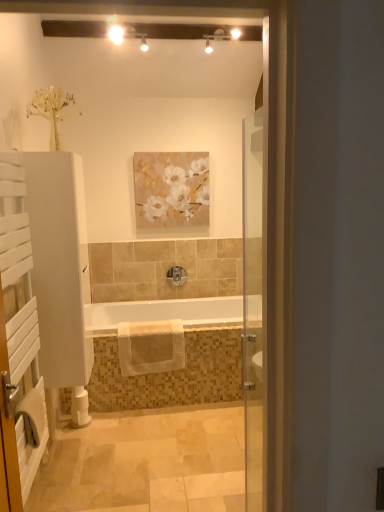
Question: Considering the relative sizes of white soft towel at lower left, which is the first bath towel from left to right, and polished chrome faucet at center in the image provided, is white soft towel at lower left, which is the first bath towel from left to right, smaller than polished chrome faucet at center?

Choices:
 (A) yes
 (B) no

Answer: (B)

Question: Considering the relative positions of white soft towel at lower left, which is the first bath towel from left to right, and polished chrome faucet at center in the image provided, is white soft towel at lower left, which is the first bath towel from left to right, to the left of polished chrome faucet at center from the viewer's perspective?

Choices:
 (A) yes
 (B) no

Answer: (A)

Question: Considering the relative sizes of white soft towel at lower left, arranged as the 2th bath towel when viewed from the right, and polished chrome faucet at center in the image provided, is white soft towel at lower left, arranged as the 2th bath towel when viewed from the right, taller than polished chrome faucet at center?

Choices:
 (A) yes
 (B) no

Answer: (B)

Question: Is white soft towel at lower left, which is the first bath towel from left to right, behind polished chrome faucet at center?

Choices:
 (A) no
 (B) yes

Answer: (A)

Question: Considering the relative sizes of white soft towel at lower left, the 2th bath towel from the back, and polished chrome faucet at center in the image provided, is white soft towel at lower left, the 2th bath towel from the back, wider than polished chrome faucet at center?

Choices:
 (A) yes
 (B) no

Answer: (A)

Question: Would you say polished chrome faucet at center is part of white soft towel at lower left, the 2th bath towel from the back,'s contents?

Choices:
 (A) yes
 (B) no

Answer: (B)

Question: Considering the relative positions of matte floral painting at upper center and white soft towel at lower left, arranged as the 2th bath towel when viewed from the right, in the image provided, is matte floral painting at upper center to the right of white soft towel at lower left, arranged as the 2th bath towel when viewed from the right, from the viewer's perspective?

Choices:
 (A) no
 (B) yes

Answer: (B)

Question: From the image's perspective, does matte floral painting at upper center appear lower than white soft towel at lower left, arranged as the 2th bath towel when viewed from the right?

Choices:
 (A) no
 (B) yes

Answer: (A)

Question: Does matte floral painting at upper center have a greater height compared to white soft towel at lower left, the 2th bath towel from the back?

Choices:
 (A) yes
 (B) no

Answer: (A)

Question: Does matte floral painting at upper center lie behind white soft towel at lower left, which is the first bath towel from left to right?

Choices:
 (A) no
 (B) yes

Answer: (B)

Question: Does matte floral painting at upper center appear on the left side of white soft towel at lower left, which is the first bath towel from left to right?

Choices:
 (A) no
 (B) yes

Answer: (A)

Question: Is matte floral painting at upper center looking in the opposite direction of white soft towel at lower left, the first bath towel viewed from the front?

Choices:
 (A) yes
 (B) no

Answer: (B)

Question: Is polished chrome faucet at center a part of white wooden towel rack at left?

Choices:
 (A) no
 (B) yes

Answer: (A)